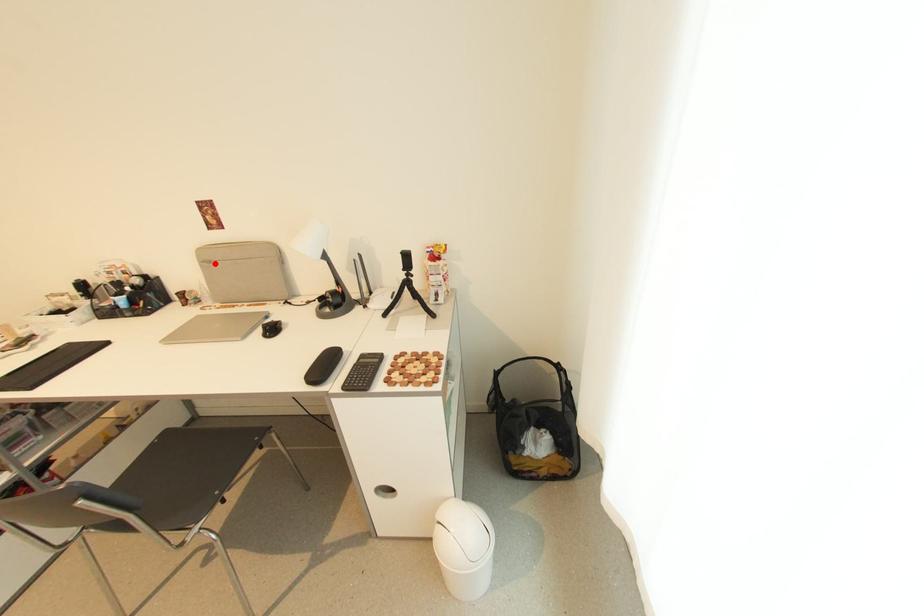
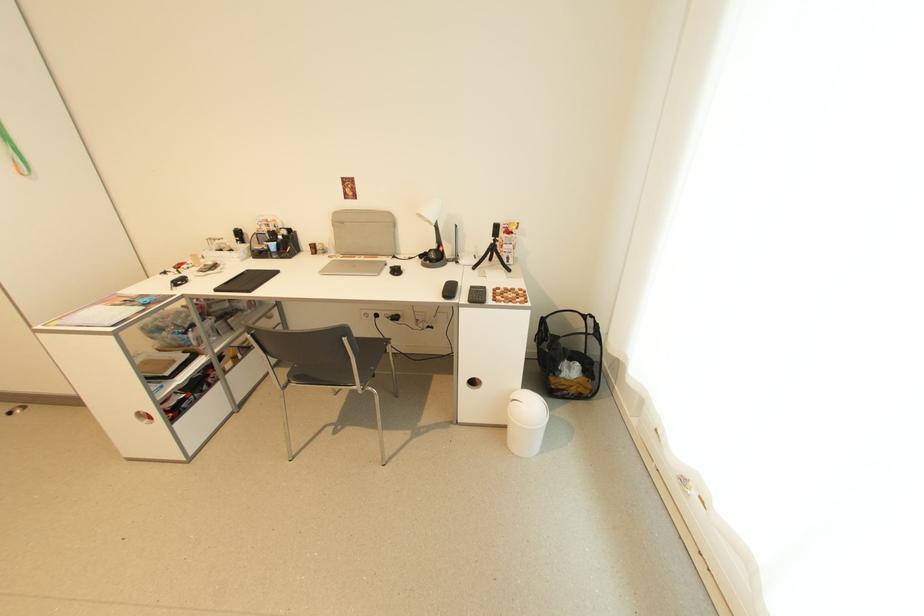
Where in the second image is the point corresponding to the highlighted location from the first image?

(347, 224)